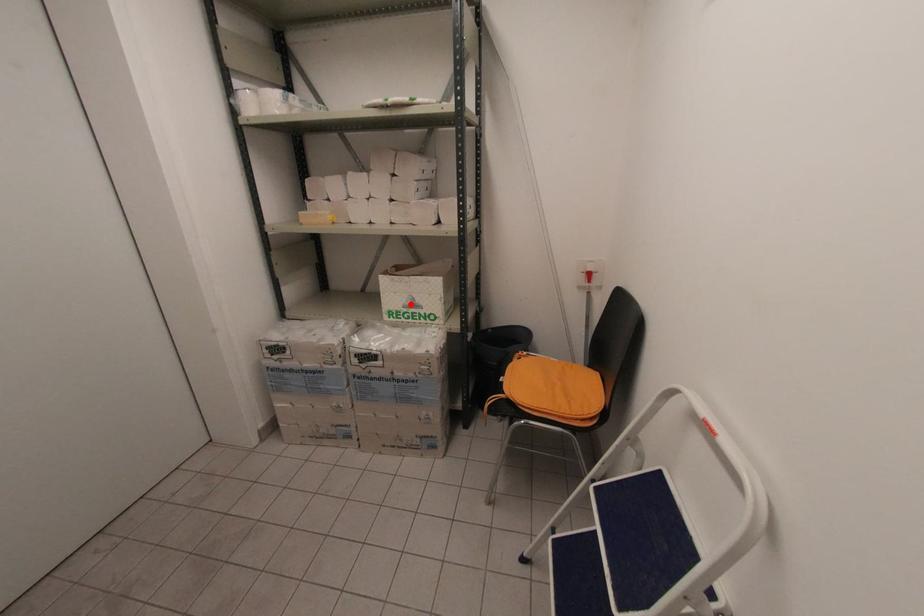
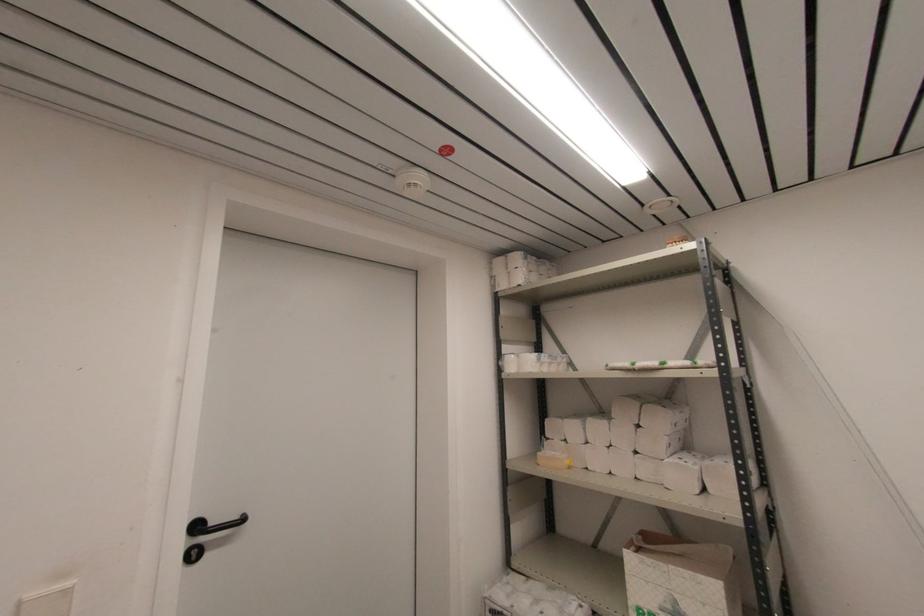
Question: I am providing you with two images of the same scene from different viewpoints. A red point is shown in image1. For the corresponding object point in image2, is it positioned nearer or farther from the camera?

Choices:
 (A) Nearer
 (B) Farther

Answer: (A)